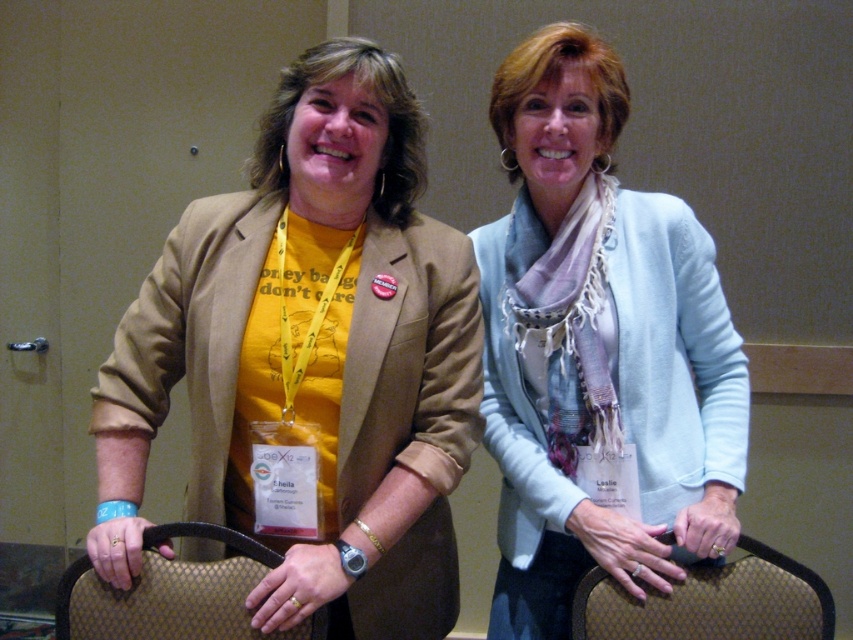
Is point (107, 461) less distant than point (592, 620)?

Yes, point (107, 461) is closer to viewer.

Is matte brown blazer at center further to the viewer compared to brown textured chair at lower right?

That is False.

What do you see at coordinates (312, 355) in the screenshot?
I see `matte brown blazer at center` at bounding box center [312, 355].

Identify the location of matte brown blazer at center. The height and width of the screenshot is (640, 853). (312, 355).

Which is more to the right, light blue sweater at center or brown textured chair at lower right?

From the viewer's perspective, brown textured chair at lower right appears more on the right side.

Is light blue sweater at center behind brown textured chair at lower right?

Yes, light blue sweater at center is behind brown textured chair at lower right.

Does point (508, 262) come farther from viewer compared to point (618, 625)?

Yes, point (508, 262) is behind point (618, 625).

The height and width of the screenshot is (640, 853). What are the coordinates of `light blue sweater at center` in the screenshot? It's located at (596, 346).

Who is positioned more to the left, matte brown blazer at center or brown textured bag at lower center?

brown textured bag at lower center

Which is above, matte brown blazer at center or brown textured bag at lower center?

Positioned higher is matte brown blazer at center.

Describe the element at coordinates (312, 355) in the screenshot. I see `matte brown blazer at center` at that location.

The height and width of the screenshot is (640, 853). Find the location of `matte brown blazer at center`. matte brown blazer at center is located at coordinates (312, 355).